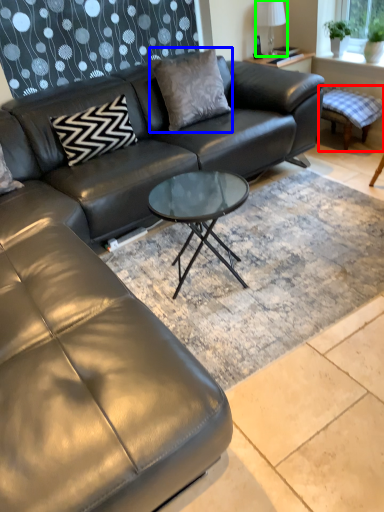
Question: Which is farther away from swivel chair (highlighted by a red box)? pillow (highlighted by a blue box) or lamp (highlighted by a green box)?

Choices:
 (A) pillow
 (B) lamp

Answer: (A)